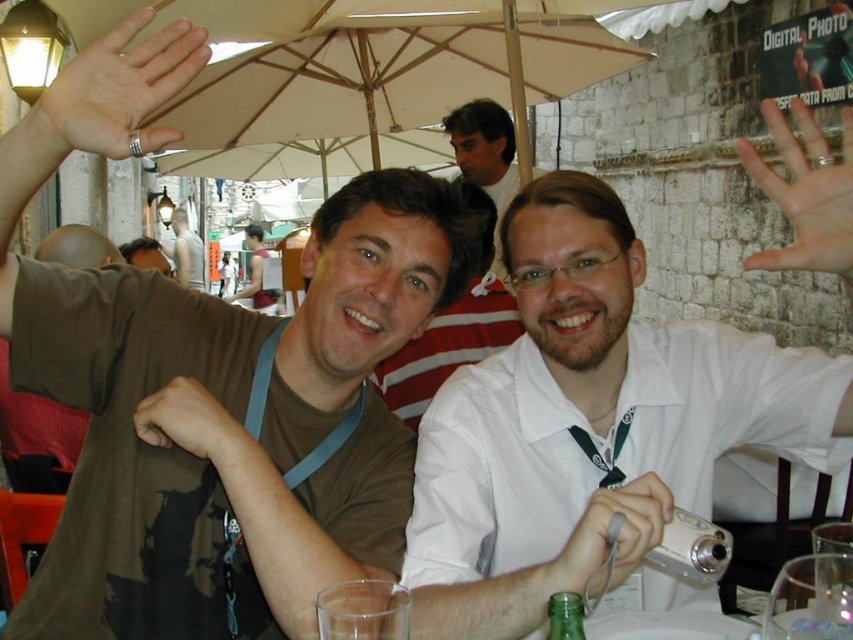
Question: Does white glossy shirt at center appear on the left side of beige fabric umbrella at upper center?

Choices:
 (A) no
 (B) yes

Answer: (A)

Question: In this image, where is silver metallic ring at upper left located relative to reddish-brown fabric shirt at center?

Choices:
 (A) left
 (B) right

Answer: (B)

Question: Which point is closer to the camera?

Choices:
 (A) reddish-brown fabric shirt at center
 (B) matte white shirt at center
 (C) matte gray shirt at center
 (D) silver metallic ring at upper left

Answer: (D)

Question: Which point appears farthest from the camera in this image?

Choices:
 (A) (178, 24)
 (B) (178, 259)

Answer: (B)

Question: Where is silver metallic ring at upper left located in relation to matte silver camera at lower center in the image?

Choices:
 (A) above
 (B) below

Answer: (A)

Question: Which of the following is the farthest from the observer?

Choices:
 (A) brown fabric shirt at upper left
 (B) beige fabric umbrella at upper center
 (C) matte gray shirt at center
 (D) light skin flesh at upper right

Answer: (C)